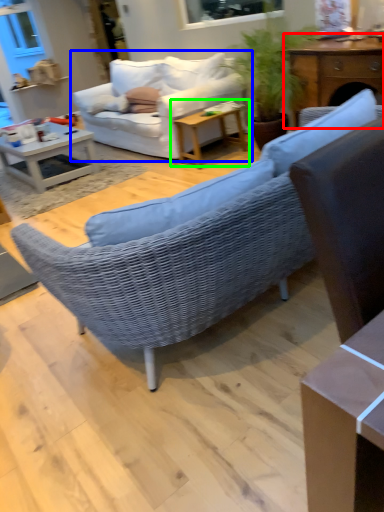
Question: Estimate the real-world distances between objects in this image. Which object is closer to table (highlighted by a red box), studio couch (highlighted by a blue box) or table (highlighted by a green box)?

Choices:
 (A) studio couch
 (B) table

Answer: (B)